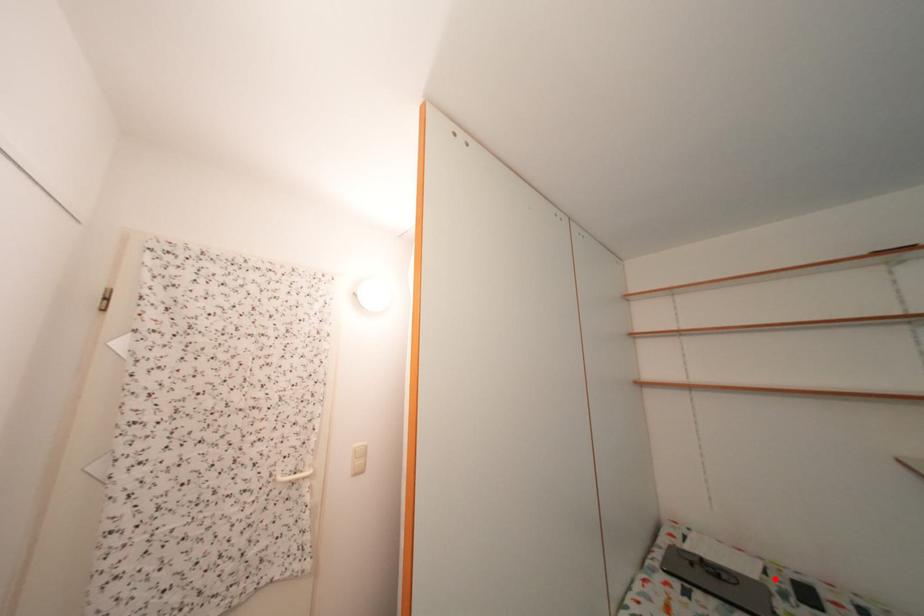
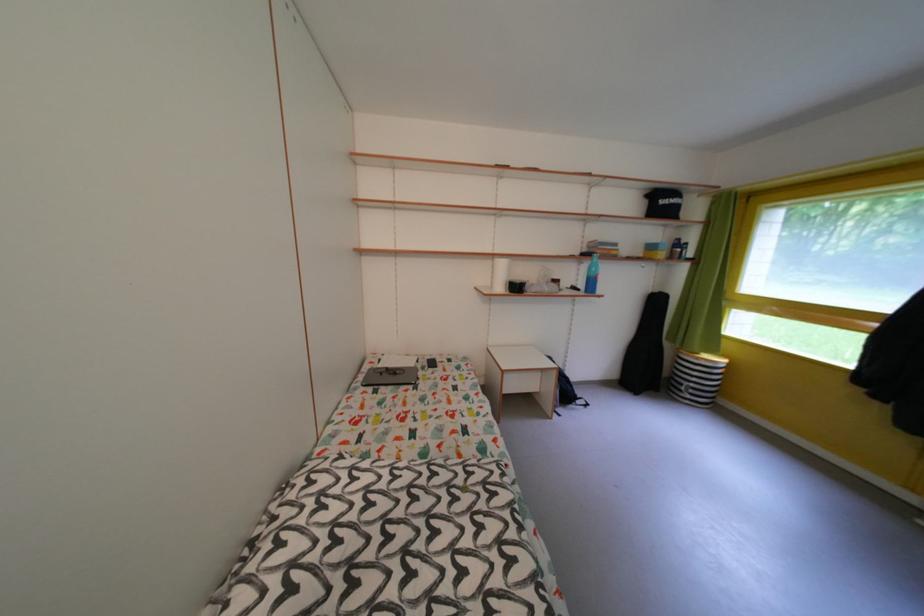
Where in the second image is the point corresponding to the highlighted location from the first image?

(428, 368)